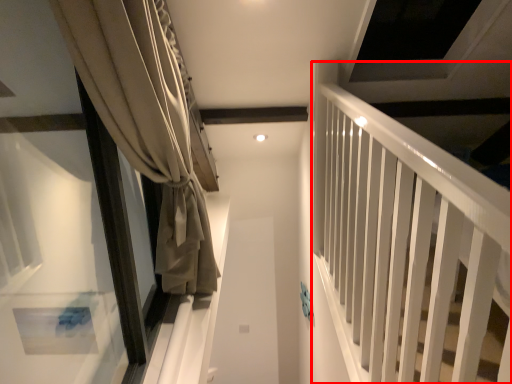
Question: From the image's perspective, what is the correct spatial positioning of bunk bed (annotated by the red box) in reference to curtain?

Choices:
 (A) below
 (B) above

Answer: (A)